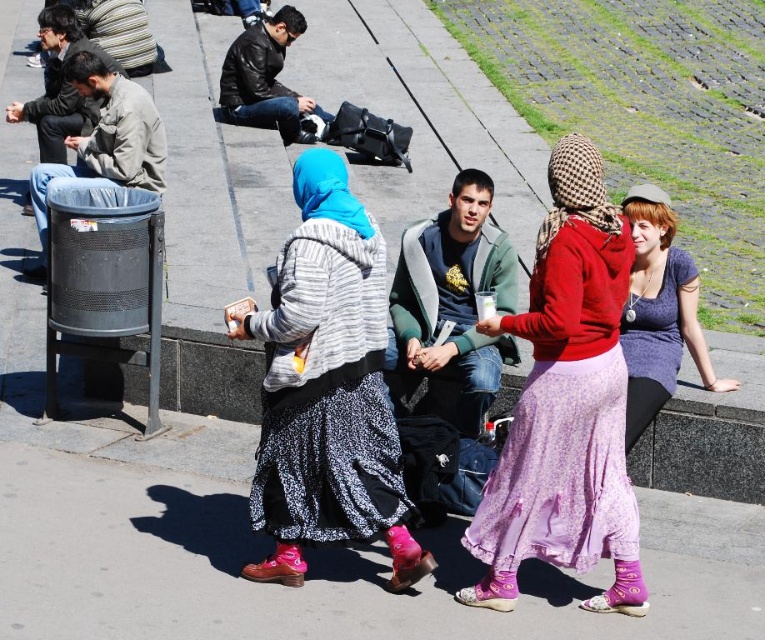
Can you confirm if matte red hoodie at center is taller than black leather jacket at upper center?

Yes, matte red hoodie at center is taller than black leather jacket at upper center.

Does matte red hoodie at center have a greater width compared to black leather jacket at upper center?

No.

Between point (578, 561) and point (287, 100), which one is positioned in front?

Point (578, 561) is more forward.

The height and width of the screenshot is (640, 765). Identify the location of matte red hoodie at center. (565, 404).

Can you confirm if matte red hoodie at center is wider than blue fabric headscarf at center?

Incorrect, matte red hoodie at center's width does not surpass blue fabric headscarf at center's.

Is point (610, 397) farther from camera compared to point (389, 548)?

That is False.

This screenshot has width=765, height=640. What are the coordinates of `matte red hoodie at center` in the screenshot? It's located at (565, 404).

Does blue fabric headscarf at center come in front of black leather jacket at upper center?

That is True.

Between blue fabric headscarf at center and black leather jacket at upper center, which one has less height?

With less height is black leather jacket at upper center.

Is point (360, 268) more distant than point (248, 109)?

No.

Find the location of a particular element. The width and height of the screenshot is (765, 640). blue fabric headscarf at center is located at coordinates (326, 387).